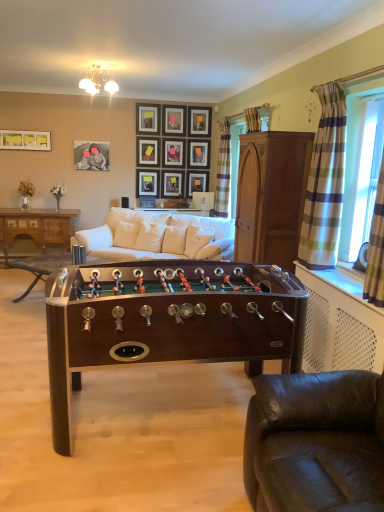
You are a GUI agent. You are given a task and a screenshot of the screen. Output one action in this format:
    pyautogui.click(x=<x>, y=<y>)
    Task: Click on the free point below mahogany wood foosball table at center, which is the 3th table from left to right (from a real-world perspective)
    The height and width of the screenshot is (512, 384).
    Given the screenshot: What is the action you would take?
    [163, 420]